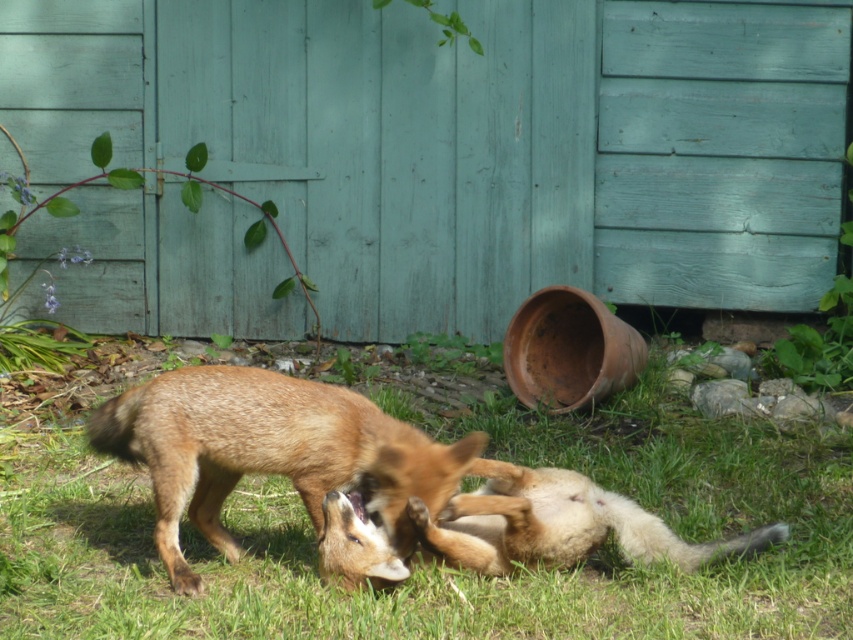
You are a photographer taking a picture of the two foxes in the scene. You notice two specific points marked in the image. Which of these points, point 1 at coordinates (161, 632) or point 2 at coordinates (125, 392), is closer to the camera and should be focused on to ensure clarity?

Point 1 at coordinates (161, 632) is closer to the camera than point 2 at coordinates (125, 392), so focusing on point 1 will ensure clarity.

You are a small animal trying to reach the golden fur fox at center from the green grass at lower center. Can you make it without crossing any obstacles?

The green grass at lower center is 27.09 inches away from the golden fur fox at center. Since there are no obstacles mentioned between them, you can reach the golden fur fox at center by moving across the green grass at lower center.

You are a drone operator trying to capture a photo of the two foxes. The camera is currently focused on the green grass at lower center. To ensure the foxes are in the frame, should you adjust the camera upwards or downwards? Please explain your reasoning based on the scene description.

The green grass at lower center is located at point (x=450, y=568) in 2D coordinates. Since the foxes are described as being in a grassy area near a wooden structure with one fox on the ground and another standing, adjusting the camera upwards would likely bring the foxes into the frame as they are positioned above the lower center grass area.